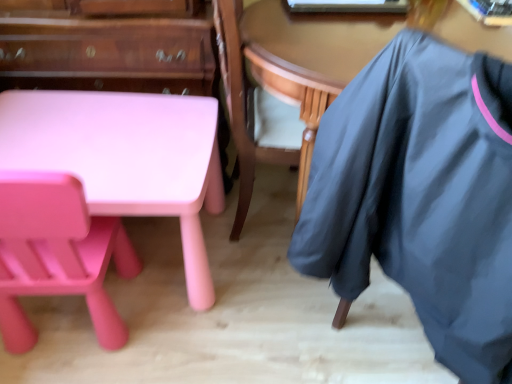
This screenshot has height=384, width=512. Identify the location of matte pink chair at lower left. (57, 254).

Locate an element on the screen. dark gray fabric at right is located at coordinates (421, 196).

This screenshot has width=512, height=384. Describe the element at coordinates (125, 158) in the screenshot. I see `matte pink plastic desk at lower left` at that location.

I want to click on wooden table at center, so (310, 59).

Locate an element on the screen. This screenshot has width=512, height=384. matte pink chair at lower left is located at coordinates (57, 254).

From the image's perspective, is dark gray fabric at right above matte pink table at lower left?

No.

Considering the positions of point (342, 247) and point (209, 76), is point (342, 247) closer or farther from the camera than point (209, 76)?

Clearly, point (342, 247) is closer to the camera than point (209, 76).

Can you tell me how much dark gray fabric at right and matte pink table at lower left differ in facing direction?

dark gray fabric at right and matte pink table at lower left are facing 152 degrees away from each other.

Can you confirm if dark gray fabric at right is shorter than matte pink table at lower left?

Incorrect, the height of dark gray fabric at right does not fall short of that of matte pink table at lower left.

Is wooden table at center a part of dark gray fabric at right?

Definitely not — wooden table at center is not inside dark gray fabric at right.

Can you confirm if dark gray fabric at right is wider than wooden table at center?

Correct, the width of dark gray fabric at right exceeds that of wooden table at center.

Which of these two, dark gray fabric at right or wooden table at center, is smaller?

wooden table at center is smaller.

Does dark gray fabric at right touch wooden table at center?

No, dark gray fabric at right is not next to wooden table at center.

Would you say dark gray fabric at right is part of matte pink plastic desk at lower left's contents?

No, dark gray fabric at right is located outside of matte pink plastic desk at lower left.

Which point is more forward, (221, 175) or (310, 204)?

The point (310, 204) is more forward.

Between matte pink plastic desk at lower left and dark gray fabric at right, which one appears on the right side from the viewer's perspective?

From the viewer's perspective, dark gray fabric at right appears more on the right side.

Could you tell me if matte pink plastic desk at lower left is turned towards dark gray fabric at right?

No.

Between matte pink table at lower left and wooden table at center, which one has larger size?

wooden table at center is bigger.

From the image's perspective, between matte pink table at lower left and wooden table at center, who is located below?

wooden table at center is shown below in the image.

Is matte pink table at lower left positioned beyond the bounds of wooden table at center?

Yes, matte pink table at lower left is outside of wooden table at center.

Would you say matte pink table at lower left is a long distance from wooden table at center?

No, matte pink table at lower left is in close proximity to wooden table at center.

Considering the relative sizes of matte pink chair at lower left and matte pink table at lower left in the image provided, is matte pink chair at lower left shorter than matte pink table at lower left?

No.

Are matte pink chair at lower left and matte pink table at lower left making contact?

No.

Is matte pink chair at lower left outside of matte pink table at lower left?

Yes, matte pink chair at lower left is not within matte pink table at lower left.

Is matte pink table at lower left not near matte pink chair at lower left?

matte pink table at lower left is actually quite close to matte pink chair at lower left.

Consider the image. In the image, is matte pink table at lower left positioned in front of or behind matte pink chair at lower left?

matte pink table at lower left is behind matte pink chair at lower left.

Can you confirm if matte pink table at lower left is bigger than matte pink chair at lower left?

Yes.

Is matte pink chair at lower left at the back of matte pink table at lower left?

matte pink table at lower left does not have its back to matte pink chair at lower left.

Considering the relative positions of wooden table at center and matte pink plastic desk at lower left in the image provided, is wooden table at center to the right of matte pink plastic desk at lower left from the viewer's perspective?

Yes.

What's the angular difference between wooden table at center and matte pink plastic desk at lower left's facing directions?

The angular difference between wooden table at center and matte pink plastic desk at lower left is 97 degrees.

Between wooden table at center and matte pink plastic desk at lower left, which one has smaller size?

Smaller between the two is matte pink plastic desk at lower left.

Where is `clothing on the right of matte pink table at lower left`? This screenshot has height=384, width=512. clothing on the right of matte pink table at lower left is located at coordinates (421, 196).

In the image, there is a dark gray fabric at right. Where is `table below it (from a real-world perspective)`? The image size is (512, 384). table below it (from a real-world perspective) is located at coordinates (310, 59).

Which object lies nearer to the anchor point matte pink table at lower left, matte pink chair at lower left or dark gray fabric at right?

The object closer to matte pink table at lower left is matte pink chair at lower left.

From the image, which object appears to be farther from dark gray fabric at right, matte pink chair at lower left or wooden table at center?

Based on the image, matte pink chair at lower left appears to be further to dark gray fabric at right.

Estimate the real-world distances between objects in this image. Which object is closer to wooden table at center, matte pink plastic desk at lower left or dark gray fabric at right?

dark gray fabric at right lies closer to wooden table at center than the other object.

From the image, which object appears to be nearer to matte pink plastic desk at lower left, dark gray fabric at right or matte pink table at lower left?

matte pink table at lower left is closer to matte pink plastic desk at lower left.

Which object lies nearer to the anchor point matte pink chair at lower left, wooden table at center or matte pink plastic desk at lower left?

matte pink plastic desk at lower left is positioned closer to the anchor matte pink chair at lower left.

Based on their spatial positions, is matte pink chair at lower left or matte pink table at lower left closer to wooden table at center?

matte pink table at lower left is positioned closer to the anchor wooden table at center.

From the image, which object appears to be farther from matte pink plastic desk at lower left, wooden table at center or dark gray fabric at right?

Among the two, dark gray fabric at right is located further to matte pink plastic desk at lower left.

Which object lies nearer to the anchor point matte pink chair at lower left, matte pink plastic desk at lower left or dark gray fabric at right?

The object closer to matte pink chair at lower left is matte pink plastic desk at lower left.

You are a GUI agent. You are given a task and a screenshot of the screen. Output one action in this format:
    pyautogui.click(x=<x>, y=<y>)
    Task: Click on the desk located between matte pink chair at lower left and dark gray fabric at right in the left-right direction
    
    Given the screenshot: What is the action you would take?
    [x=125, y=158]

This screenshot has height=384, width=512. What are the coordinates of `desk between matte pink chair at lower left and wooden table at center in the horizontal direction` in the screenshot? It's located at (125, 158).

Locate an element on the screen. The image size is (512, 384). table between matte pink table at lower left and dark gray fabric at right in the horizontal direction is located at coordinates (310, 59).

This screenshot has height=384, width=512. Identify the location of desk between matte pink table at lower left and matte pink chair at lower left from top to bottom. (125, 158).